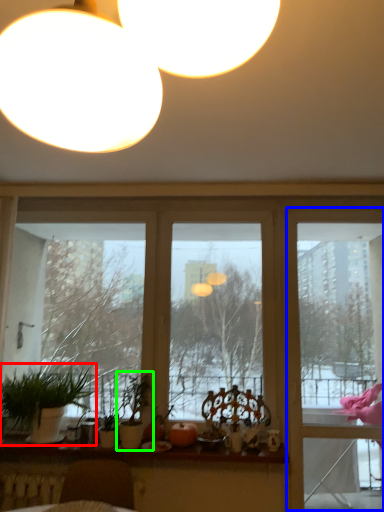
Question: Based on their relative distances, which object is farther from houseplant (highlighted by a red box)? Choose from screen door (highlighted by a blue box) and houseplant (highlighted by a green box).

Choices:
 (A) screen door
 (B) houseplant

Answer: (A)